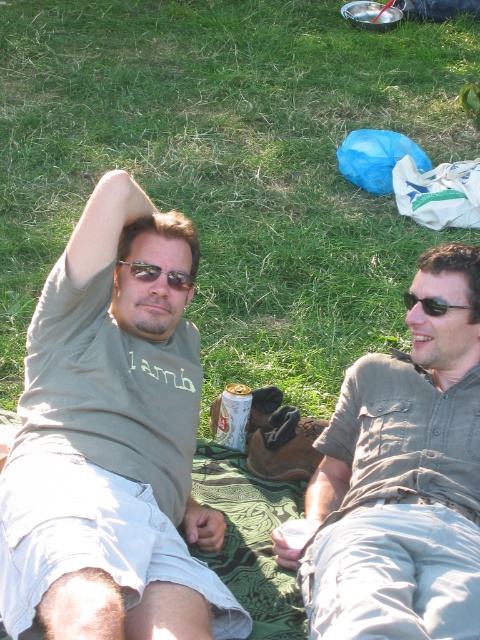
Question: Among these objects, which one is farthest from the camera?

Choices:
 (A) black plastic sunglasses at right
 (B) matte khaki shirt at center
 (C) matte khaki shirt at upper left
 (D) green grass at upper center

Answer: (D)

Question: Among these objects, which one is farthest from the camera?

Choices:
 (A) matte khaki shirt at center
 (B) matte khaki shirt at upper left
 (C) green grass at upper center

Answer: (C)

Question: Does green grass at upper center appear over black plastic sunglasses at right?

Choices:
 (A) no
 (B) yes

Answer: (B)

Question: Can you confirm if gold metallic can at center is positioned below matte black sunglasses at upper left?

Choices:
 (A) no
 (B) yes

Answer: (B)

Question: Which of the following is the closest to the observer?

Choices:
 (A) matte black sunglasses at upper left
 (B) matte khaki shirt at center
 (C) black plastic sunglasses at right

Answer: (B)

Question: Does green grass at upper center have a greater width compared to gold metallic can at center?

Choices:
 (A) no
 (B) yes

Answer: (B)